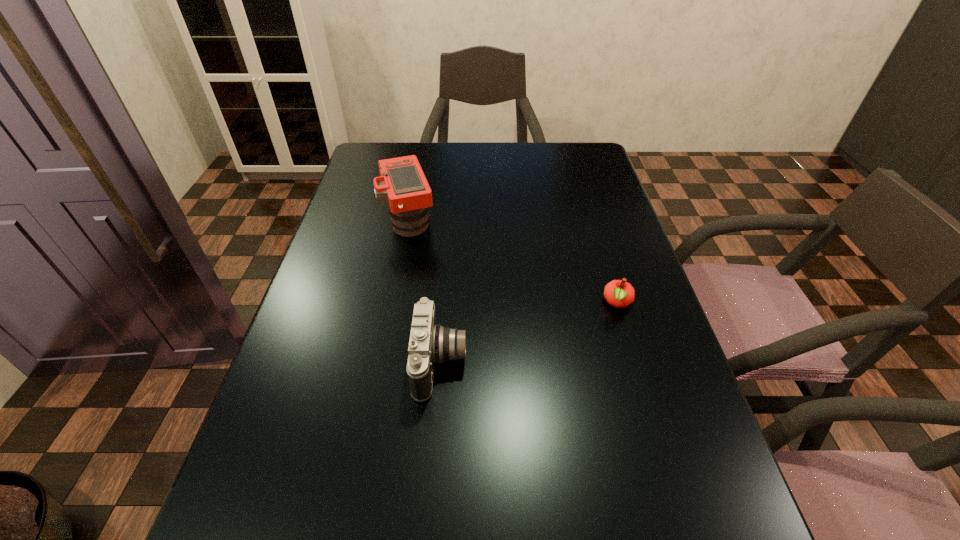
This screenshot has height=540, width=960. What are the coordinates of `vacant area that lies between the farthest object and the second shortest object` in the screenshot? It's located at tap(425, 292).

Where is `unoccupied position between the tallest object and the second shortest object`? Image resolution: width=960 pixels, height=540 pixels. unoccupied position between the tallest object and the second shortest object is located at coordinates pyautogui.click(x=425, y=292).

The image size is (960, 540). Find the location of `free space between the second shortest object and the farthest object`. free space between the second shortest object and the farthest object is located at coordinates (425, 292).

The width and height of the screenshot is (960, 540). I want to click on free spot between the farther camera and the nearest object, so click(425, 292).

The image size is (960, 540). I want to click on free space that is in between the nearer camera and the farthest object, so tap(425, 292).

Where is `object that can be found as the second closest to the apple`? This screenshot has width=960, height=540. object that can be found as the second closest to the apple is located at coordinates (402, 185).

Locate which object is the second closest to the second nearest object. Please provide its 2D coordinates. Your answer should be formatted as a tuple, i.e. [(x, y)], where the tuple contains the x and y coordinates of a point satisfying the conditions above.

[(402, 185)]

In order to click on free space that satisfies the following two spatial constraints: 1. on the front side of the rightmost object; 2. on the left side of the farthest object in this screenshot , I will do `click(394, 303)`.

Image resolution: width=960 pixels, height=540 pixels. Identify the location of free space that satisfies the following two spatial constraints: 1. on the front side of the farther camera; 2. on the right side of the shortest object. (394, 303).